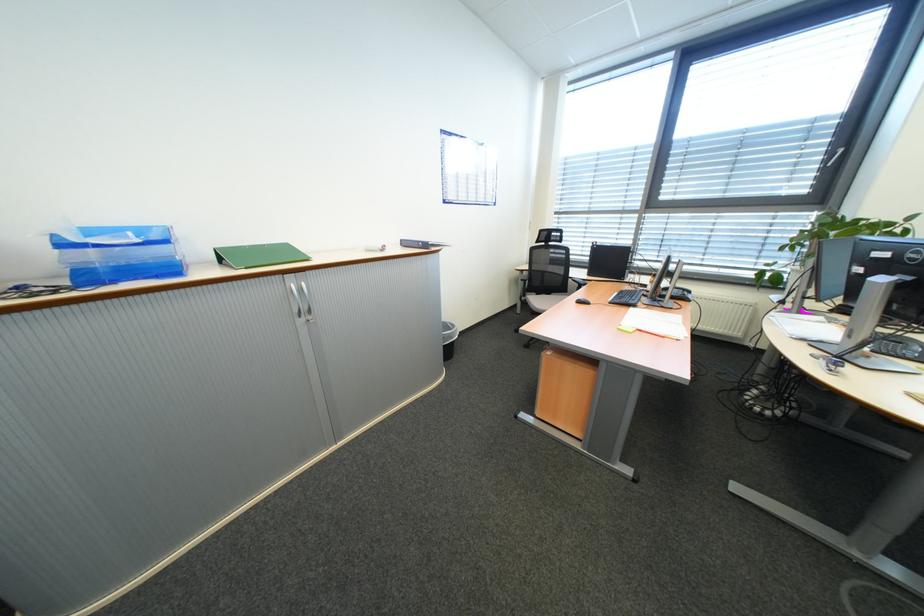
Where is `black computer mouse`? Image resolution: width=924 pixels, height=616 pixels. black computer mouse is located at coordinates (581, 301).